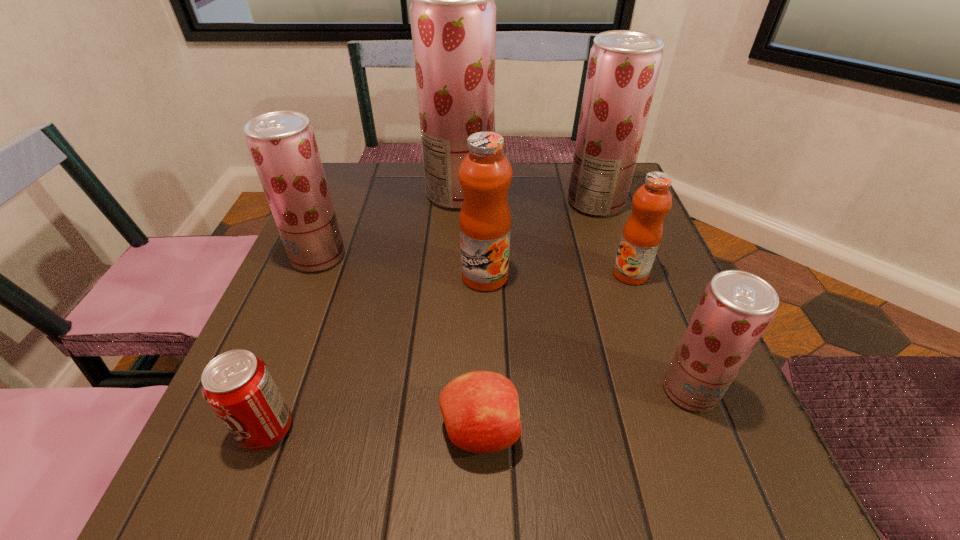
Find the location of a particular element. The image size is (960, 540). unoccupied area between the red apple and the third biggest strawberry fruit juice is located at coordinates pos(399,344).

Where is `empty location between the right orange fruit juice and the nearest fruit juice`? The image size is (960, 540). empty location between the right orange fruit juice and the nearest fruit juice is located at coordinates (660, 332).

You are a GUI agent. You are given a task and a screenshot of the screen. Output one action in this format:
    pyautogui.click(x=<x>, y=<y>)
    Task: Click on the free space between the third smallest strawberry fruit juice and the second strawberry fruit juice from left to right
    
    Given the screenshot: What is the action you would take?
    pyautogui.click(x=528, y=198)

The height and width of the screenshot is (540, 960). In order to click on object that stands as the closest to the shortest object in this screenshot , I will do `click(238, 386)`.

Image resolution: width=960 pixels, height=540 pixels. In order to click on object that is the fourth closest to the second smallest strawberry fruit juice in this screenshot , I will do `click(480, 409)`.

Where is `fruit juice that is the fourth nearest to the second tallest fruit juice`? The height and width of the screenshot is (540, 960). fruit juice that is the fourth nearest to the second tallest fruit juice is located at coordinates (736, 307).

This screenshot has width=960, height=540. I want to click on fruit juice identified as the second closest to the bigger orange fruit juice, so click(642, 233).

Point out which strawberry fruit juice is positioned as the second nearest to the apple. Please provide its 2D coordinates. Your answer should be formatted as a tuple, i.e. [(x, y)], where the tuple contains the x and y coordinates of a point satisfying the conditions above.

[(282, 144)]

Identify which strawberry fruit juice is located as the nearest to the second biggest strawberry fruit juice. Please provide its 2D coordinates. Your answer should be formatted as a tuple, i.e. [(x, y)], where the tuple contains the x and y coordinates of a point satisfying the conditions above.

[(453, 15)]